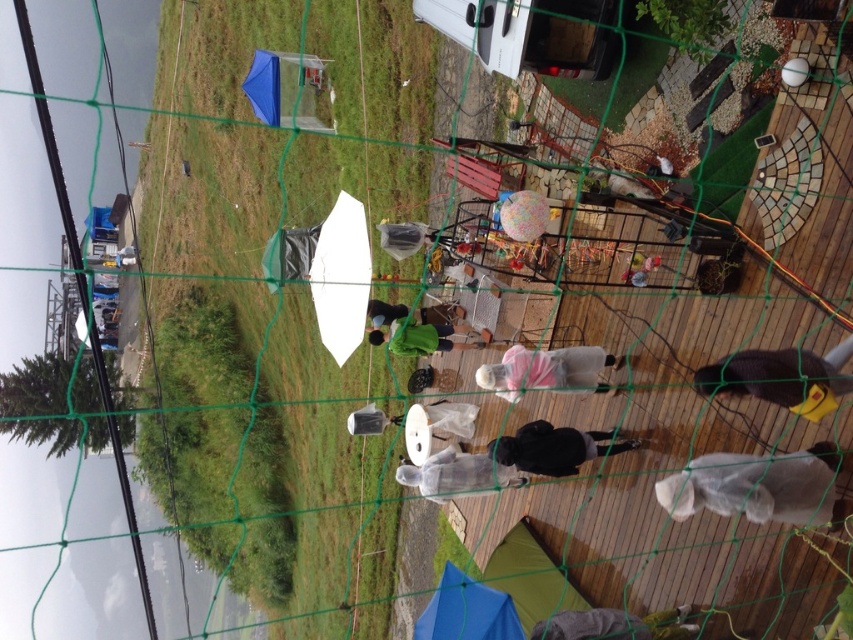
You are at a festival and see both the clear plastic bag at center and the black matte jacket at center. Which object is closer to you?

The clear plastic bag at center is closer to you because it is in front of the black matte jacket at center.

You are standing at the center of the image looking towards the fence. Which direction should you move to find the clear plastic bag at lower right?

The clear plastic bag at lower right is located at point (759, 486), which is in the lower right area of the image. To reach it, you should move towards the lower right direction from the center.

You are at the festival and need to retrieve an item from your clear plastic bag at center. Where should you look relative to the black matte jacket at center?

The clear plastic bag at center is located below the black matte jacket at center, so you should look downward from the black matte jacket at center to find it.